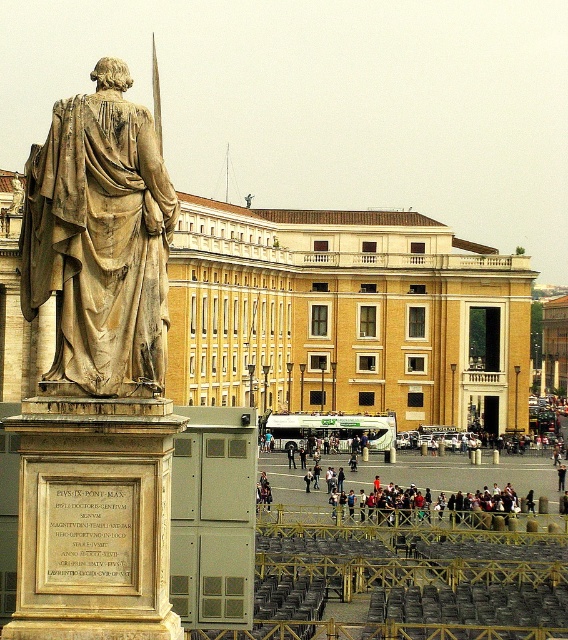
You are standing in front of the statue and see a point at coordinates (346, 316). What does this point represent in the scene?

The point at coordinates (346, 316) corresponds to the beige stone building at center.

You are standing at the edge of the scene and want to walk towards the beige stone building at center and the dark gray fabric jacket at center. Which one should you walk towards first to reach the one on the right side?

The beige stone building at center is to the left of dark gray fabric jacket at center, so you should walk towards the dark gray fabric jacket at center first to reach the one on the right side.